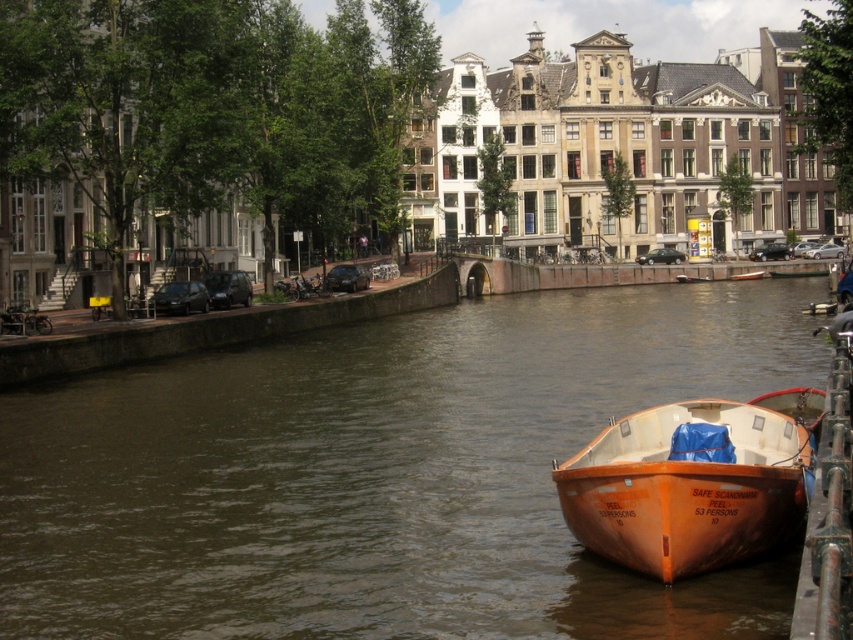
Which is above, brown water at center or orange wood canoe at center?

Positioned higher is orange wood canoe at center.

Which is behind, point (224, 436) or point (753, 269)?

The point (753, 269) is more distant.

Find the location of a particular element. brown water at center is located at coordinates (383, 474).

Who is higher up, orange matte boat at lower right or orange wood canoe at center?

Positioned higher is orange wood canoe at center.

Does orange matte boat at lower right appear over orange wood canoe at center?

No.

Describe the element at coordinates (689, 484) in the screenshot. Image resolution: width=853 pixels, height=640 pixels. I see `orange matte boat at lower right` at that location.

Where is `orange matte boat at lower right`? orange matte boat at lower right is located at coordinates (689, 484).

Who is positioned more to the left, brown water at center or orange matte boat at lower right?

brown water at center

Is point (270, 440) more distant than point (665, 513)?

Yes, it is behind point (665, 513).

Find the location of `brown water at center`. brown water at center is located at coordinates (383, 474).

Identify the location of brown water at center. (383, 474).